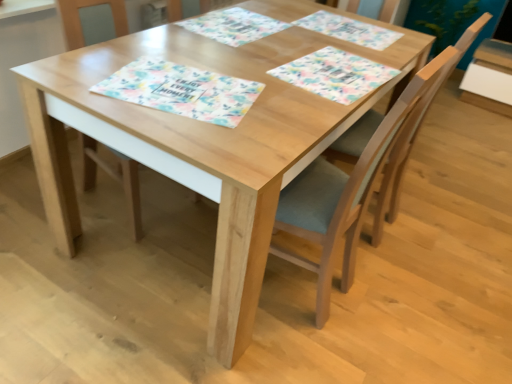
The width and height of the screenshot is (512, 384). What are the coordinates of `free point to the right of floral paper placemat at upper center, the third place mat in the front-to-back sequence` in the screenshot? It's located at (315, 40).